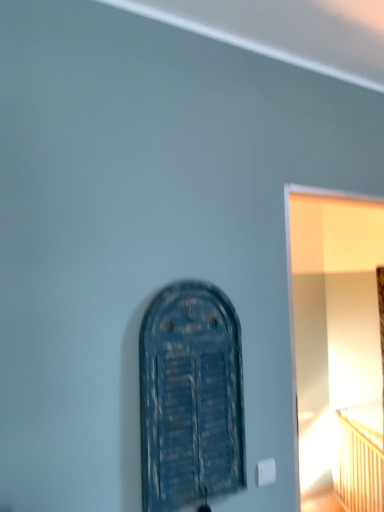
The width and height of the screenshot is (384, 512). I want to click on wooden bed at right, so click(357, 464).

Is white glossy door at right outside of wooden bed at right?

white glossy door at right is positioned outside wooden bed at right.

From the image's perspective, relative to wooden bed at right, is white glossy door at right above or below?

From the image's perspective, white glossy door at right appears above wooden bed at right.

From a real-world perspective, between white glossy door at right and wooden bed at right, who is vertically higher?

white glossy door at right is physically above.

Based on the photo, who is taller, white glossy door at right or wooden bed at right?

white glossy door at right.

From a real-world perspective, who is located lower, wooden bed at right or white glossy door at right?

In real-world perspective, wooden bed at right is lower.

From the image's perspective, relative to white glossy door at right, is wooden bed at right above or below?

Based on their image positions, wooden bed at right is located beneath white glossy door at right.

Is wooden bed at right taller or shorter than white glossy door at right?

In the image, wooden bed at right appears to be shorter than white glossy door at right.

In terms of width, does wooden bed at right look wider or thinner when compared to white glossy door at right?

Considering their sizes, wooden bed at right looks slimmer than white glossy door at right.

Is blue wooden door at center to the left of white glossy door at right from the viewer's perspective?

Yes.

This screenshot has width=384, height=512. In order to click on door that appears in front of the white glossy door at right in this screenshot , I will do `click(191, 398)`.

Considering the relative sizes of blue wooden door at center and white glossy door at right in the image provided, is blue wooden door at center taller than white glossy door at right?

Incorrect, the height of blue wooden door at center is not larger of that of white glossy door at right.

Which object is thinner, blue wooden door at center or white glossy door at right?

blue wooden door at center is thinner.

Would you consider blue wooden door at center to be distant from wooden bed at right?

Absolutely, blue wooden door at center is distant from wooden bed at right.

In the image, there is a blue wooden door at center. Find the location of `bed below it (from the image's perspective)`. bed below it (from the image's perspective) is located at coordinates (357, 464).

In terms of size, does blue wooden door at center appear bigger or smaller than wooden bed at right?

Considering their sizes, blue wooden door at center takes up less space than wooden bed at right.

How far apart are blue wooden door at center and wooden bed at right?

6.03 feet.

From a real-world perspective, is white glossy door at right physically located above or below blue wooden door at center?

In terms of real-world spatial position, white glossy door at right is below blue wooden door at center.

Which object is closer to the camera taking this photo, white glossy door at right or blue wooden door at center?

blue wooden door at center.

From the image's perspective, which object appears higher, white glossy door at right or blue wooden door at center?

blue wooden door at center is shown above in the image.

Is white glossy door at right located outside blue wooden door at center?

Absolutely, white glossy door at right is external to blue wooden door at center.

Considering the sizes of objects wooden bed at right and blue wooden door at center in the image provided, who is taller, wooden bed at right or blue wooden door at center?

blue wooden door at center.

Which is more to the left, wooden bed at right or blue wooden door at center?

blue wooden door at center.

Is blue wooden door at center at the back of wooden bed at right?

No, wooden bed at right is not facing away from blue wooden door at center.

Is wooden bed at right not close to blue wooden door at center?

Yes, wooden bed at right and blue wooden door at center are located far from each other.

I want to click on window frame that is on the left side of wooden bed at right, so click(x=330, y=316).

Find the location of a particular element. This screenshot has width=384, height=512. bed on the right of white glossy door at right is located at coordinates (357, 464).

From the image, which object appears to be farther from wooden bed at right, white glossy door at right or blue wooden door at center?

Among the two, blue wooden door at center is located further to wooden bed at right.

When comparing their distances from blue wooden door at center, does wooden bed at right or white glossy door at right seem further?

The object further to blue wooden door at center is white glossy door at right.

Based on their spatial positions, is blue wooden door at center or white glossy door at right closer to wooden bed at right?

white glossy door at right is closer to wooden bed at right.

When comparing their distances from white glossy door at right, does blue wooden door at center or wooden bed at right seem further?

The object further to white glossy door at right is blue wooden door at center.

When comparing their distances from white glossy door at right, does wooden bed at right or blue wooden door at center seem closer?

wooden bed at right is positioned closer to the anchor white glossy door at right.

When comparing their distances from blue wooden door at center, does white glossy door at right or wooden bed at right seem further?

white glossy door at right.

I want to click on window frame between blue wooden door at center and wooden bed at right vertically, so click(x=330, y=316).